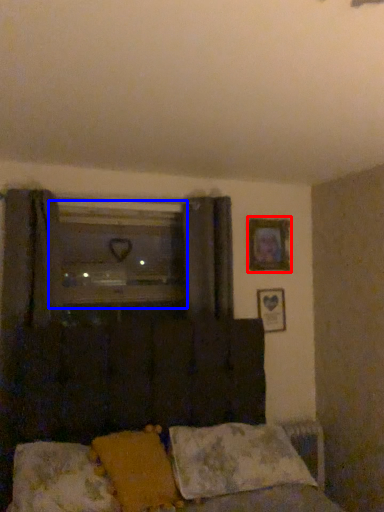
Question: Which object is closer to the camera taking this photo, picture frame (highlighted by a red box) or window (highlighted by a blue box)?

Choices:
 (A) picture frame
 (B) window

Answer: (B)